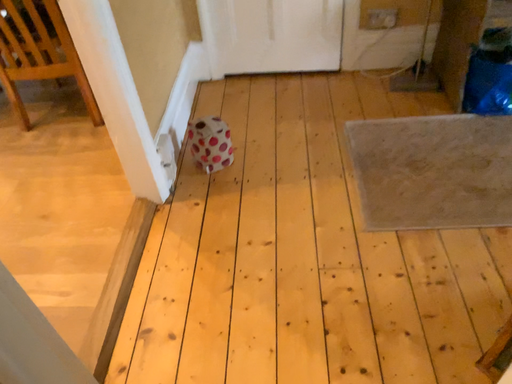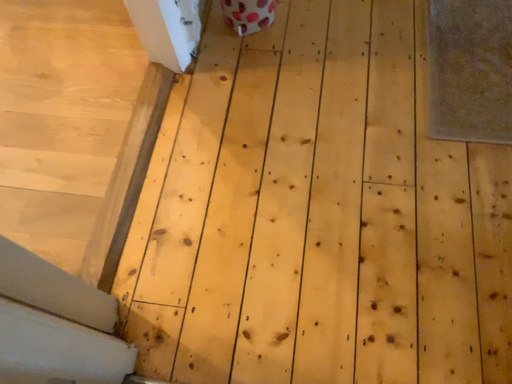
Question: Which way did the camera rotate in the video?

Choices:
 (A) rotated downward
 (B) rotated upward

Answer: (A)